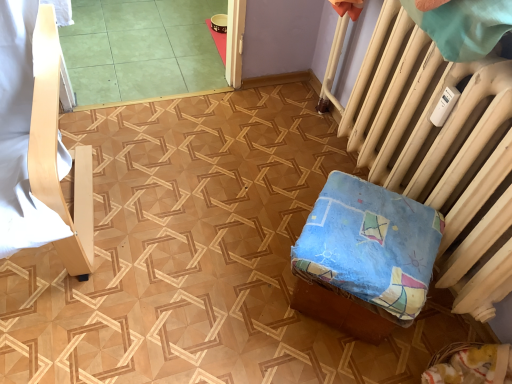
Image resolution: width=512 pixels, height=384 pixels. I want to click on empty space that is ontop of green tile at upper left, so (150, 38).